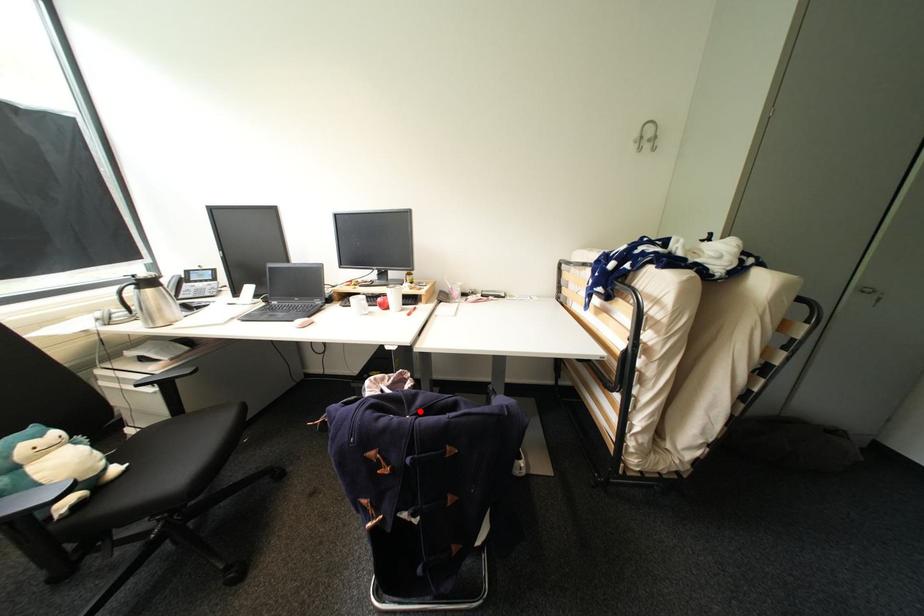
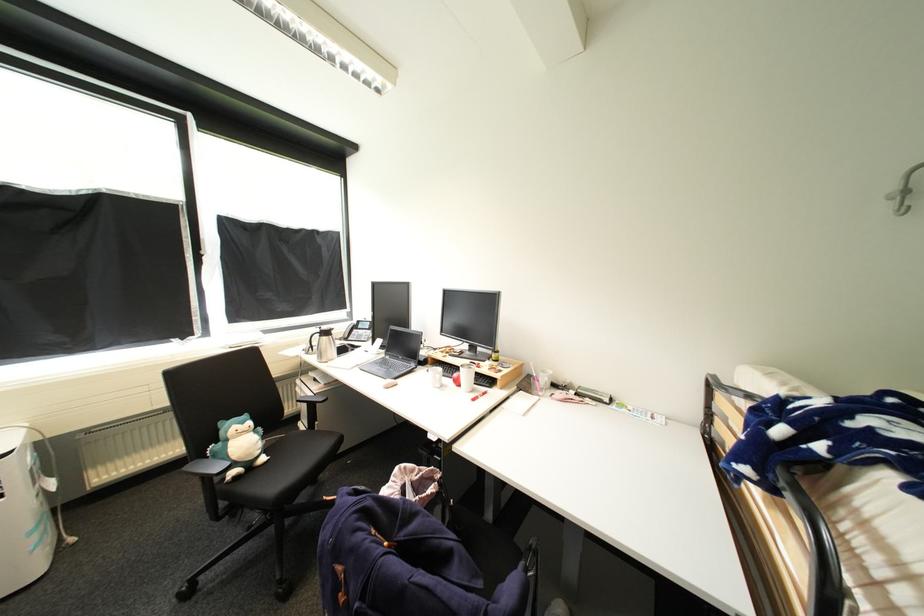
Question: I am providing you with two images of the same scene from different viewpoints. A red point is marked on the first image. At the location where the point appears in image 1, is it still visible in image 2?

Choices:
 (A) Yes
 (B) No

Answer: (A)